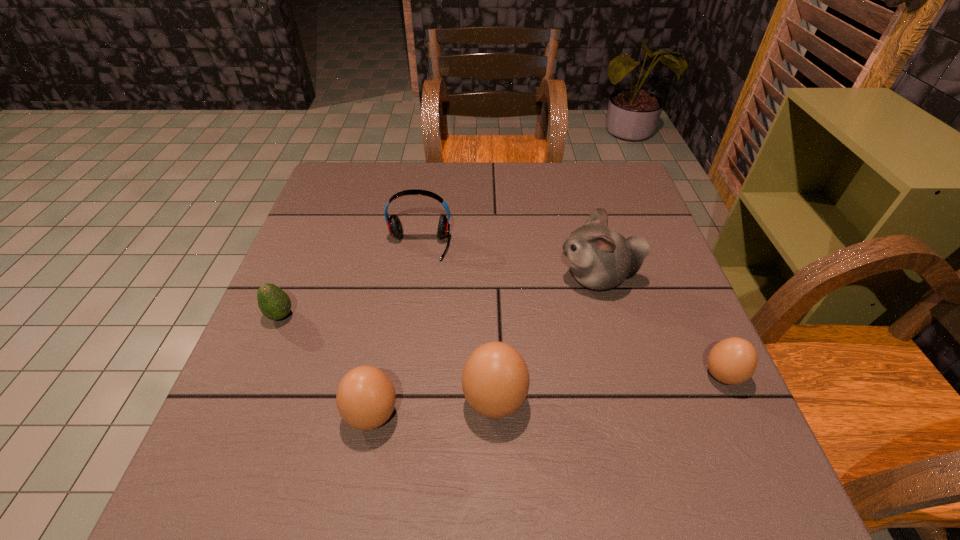
To make them evenly spaced by inserting another boiled_egg among them, please locate a free space for this new boiled_egg. Please provide its 2D coordinates. Your answer should be formatted as a tuple, i.e. [(x, y)], where the tuple contains the x and y coordinates of a point satisfying the conditions above.

[(612, 388)]